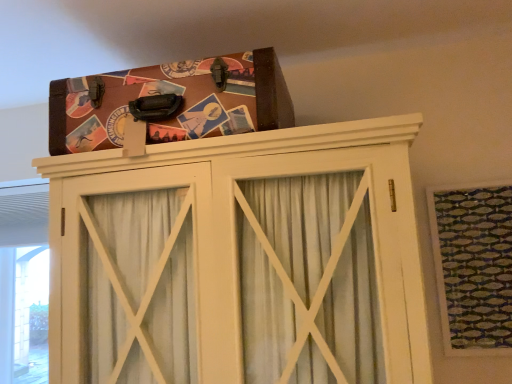
Question: Is green textured fabric at upper right in front of or behind brown leather suitcase at upper center in the image?

Choices:
 (A) front
 (B) behind

Answer: (B)

Question: From the image's perspective, relative to brown leather suitcase at upper center, is green textured fabric at upper right above or below?

Choices:
 (A) below
 (B) above

Answer: (A)

Question: Which of these objects is positioned farthest from the brown leather suitcase at upper center?

Choices:
 (A) wooden cabinet at upper center
 (B) green textured fabric at upper right

Answer: (B)

Question: Estimate the real-world distances between objects in this image. Which object is closer to the green textured fabric at upper right?

Choices:
 (A) brown leather suitcase at upper center
 (B) wooden cabinet at upper center

Answer: (B)